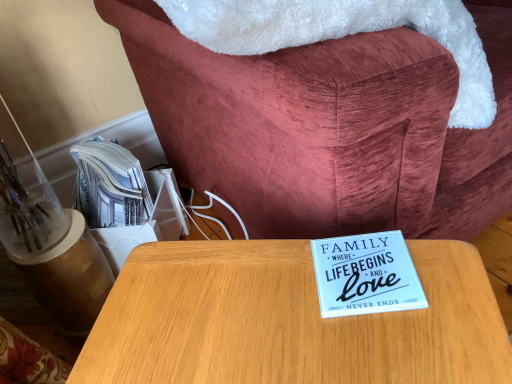
Find the location of a particular element. vacant region above wooden table at center (from a real-world perspective) is located at coordinates (391, 304).